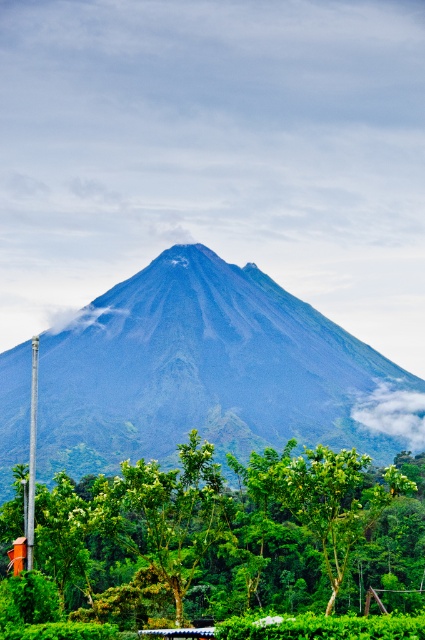
Question: Is green leafy tree at center bigger than metallic pole at left?

Choices:
 (A) no
 (B) yes

Answer: (A)

Question: Does green leafy tree at center have a smaller size compared to metallic pole at left?

Choices:
 (A) yes
 (B) no

Answer: (A)

Question: Can you confirm if dark gray volcanic rock mountain at center is positioned to the right of green leafy tree at center?

Choices:
 (A) no
 (B) yes

Answer: (A)

Question: Which point is farther from the camera taking this photo?

Choices:
 (A) (27, 531)
 (B) (36, 531)
 (C) (201, 292)

Answer: (C)

Question: Among these objects, which one is nearest to the camera?

Choices:
 (A) metallic pole at left
 (B) dark gray volcanic rock mountain at center
 (C) green leafy tree at center

Answer: (C)

Question: Which point is closer to the camera?

Choices:
 (A) (340, 326)
 (B) (272, 454)

Answer: (B)